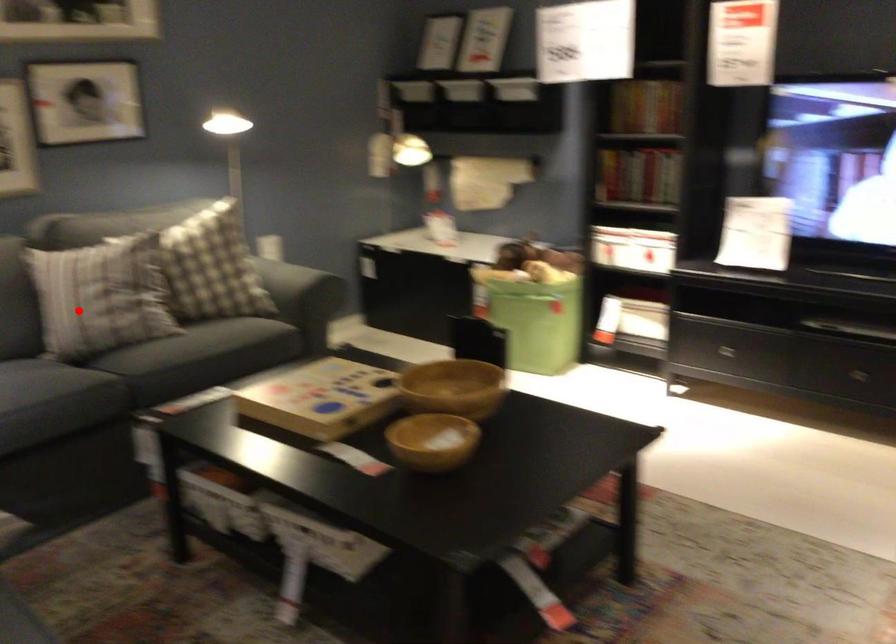
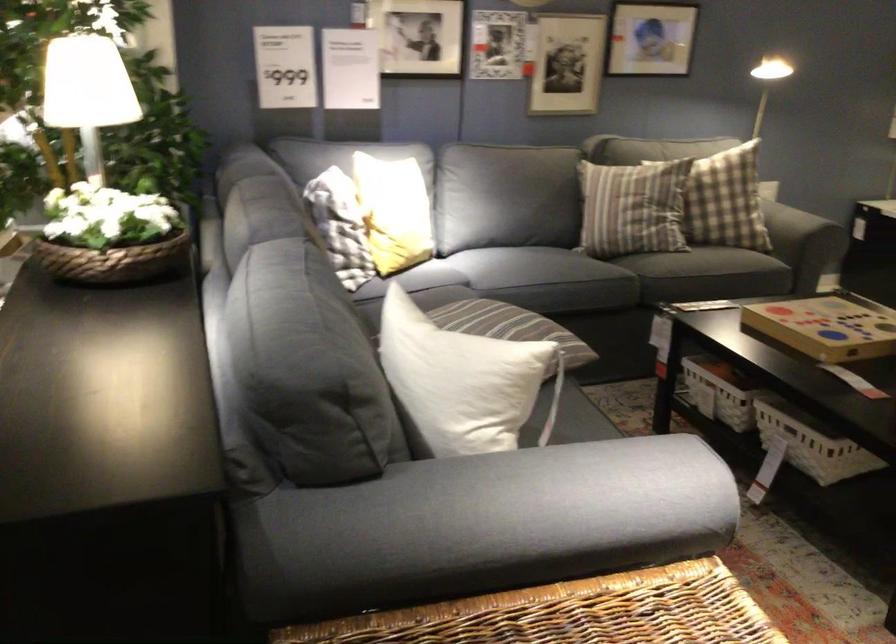
In the second image, find the point that corresponds to the highlighted location in the first image.

(633, 207)